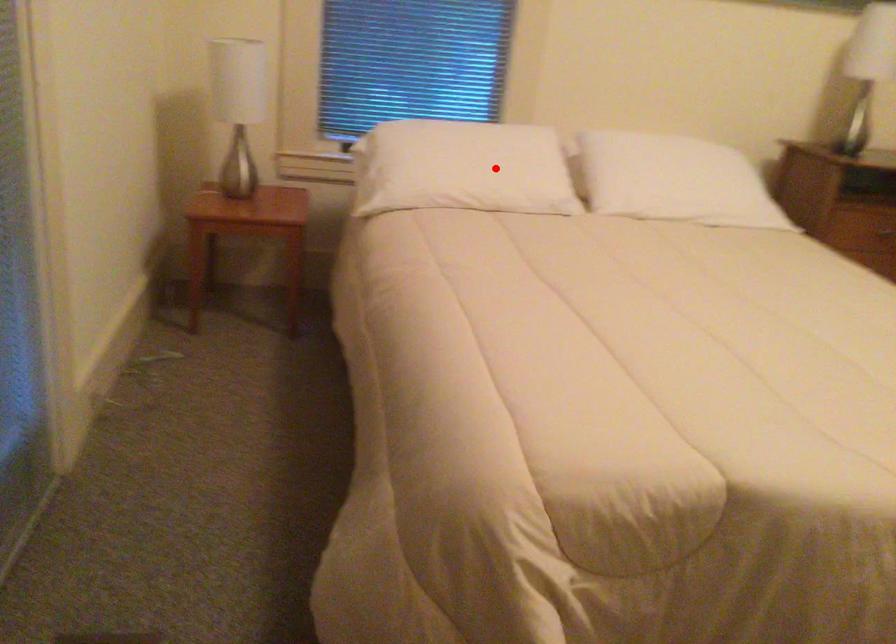
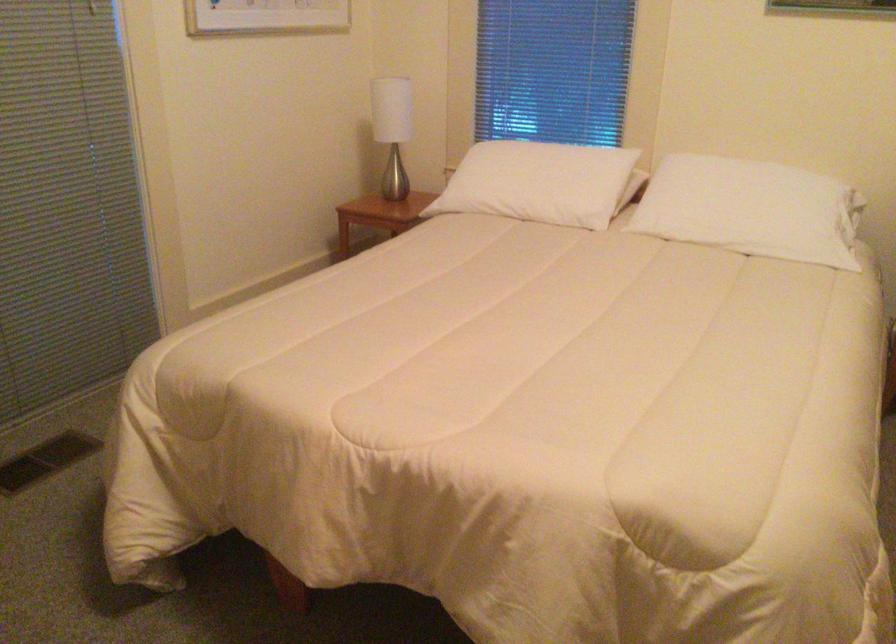
Where in the second image is the point corresponding to the highlighted location from the first image?

(538, 183)